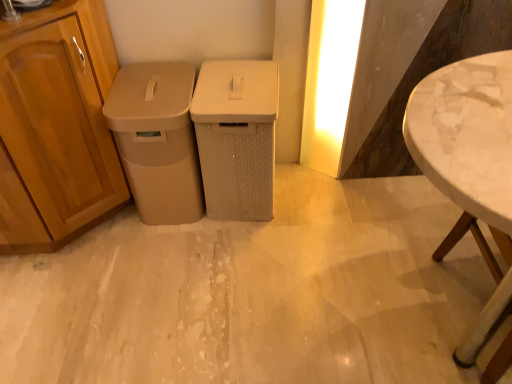
Question: Is beige textured waste bin at center, positioned as the 1th waste container in right-to-left order, taller or shorter than yellow matte light at upper right?

Choices:
 (A) tall
 (B) short

Answer: (B)

Question: From a real-world perspective, is beige textured waste bin at center, which appears as the second waste container when viewed from the left, physically located above or below yellow matte light at upper right?

Choices:
 (A) below
 (B) above

Answer: (A)

Question: Based on their relative distances, which object is farther from the beige matte trash can at left, which appears as the 2th waste container when viewed from the right?

Choices:
 (A) white marble table at right
 (B) beige textured waste bin at center, which appears as the second waste container when viewed from the left
 (C) yellow matte light at upper right

Answer: (A)

Question: Which is nearer to the yellow matte light at upper right?

Choices:
 (A) beige textured waste bin at center, positioned as the 1th waste container in right-to-left order
 (B) white marble table at right
 (C) beige matte trash can at left, which appears as the 2th waste container when viewed from the right

Answer: (A)